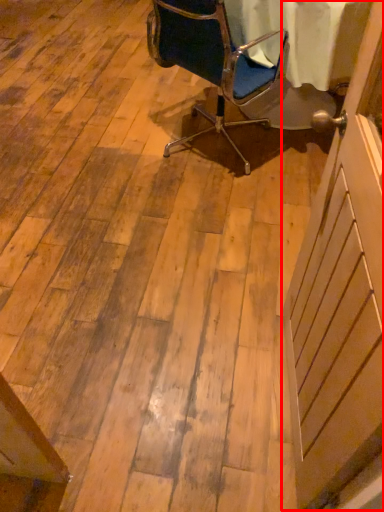
Question: Considering the relative positions of screen door (annotated by the red box) and chair in the image provided, where is screen door (annotated by the red box) located with respect to the staircase?

Choices:
 (A) left
 (B) right

Answer: (B)